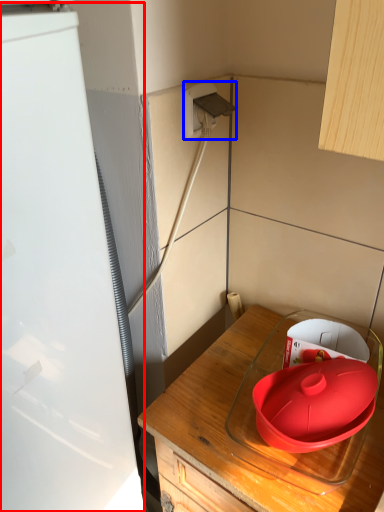
Question: Which point is further to the camera, appliance (highlighted by a red box) or electric outlet (highlighted by a blue box)?

Choices:
 (A) appliance
 (B) electric outlet

Answer: (B)